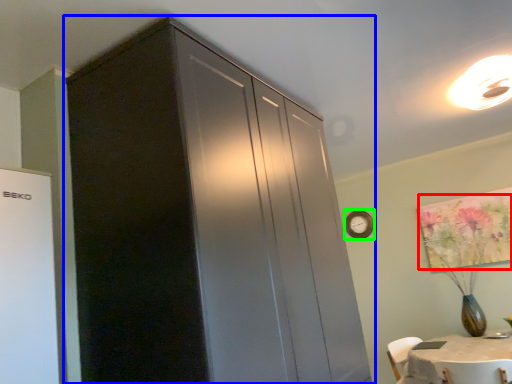
Question: Which object is the closest to the flower (highlighted by a red box)? Choose among these: cupboard (highlighted by a blue box) or clock (highlighted by a green box).

Choices:
 (A) cupboard
 (B) clock

Answer: (B)